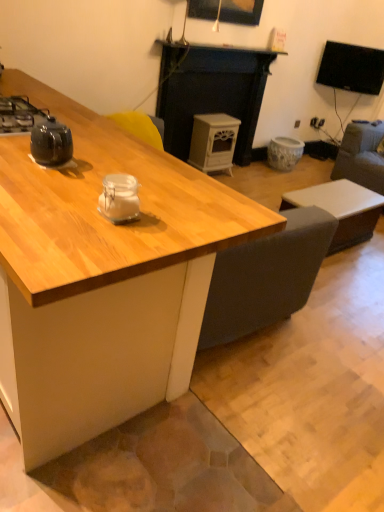
What are the coordinates of `vacant area that lies to the right of matte black teapot at left` in the screenshot? It's located at (108, 166).